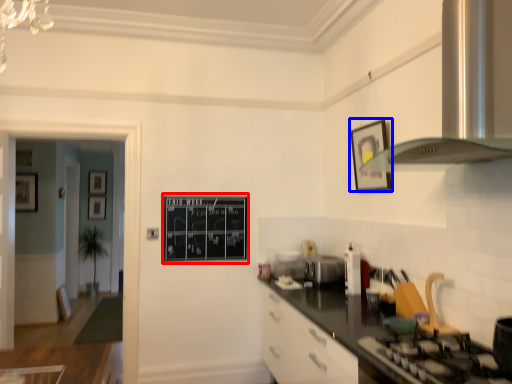
Question: Which point is further to the camera, bulletin board (highlighted by a red box) or picture frame (highlighted by a blue box)?

Choices:
 (A) bulletin board
 (B) picture frame

Answer: (A)